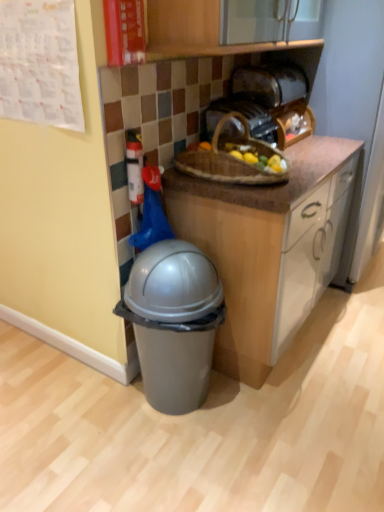
Question: Which direction should I rotate to look at satin gold toaster at upper center, the second toaster ordered from the bottom?

Choices:
 (A) left
 (B) right

Answer: (B)

Question: Is wooden basket at upper center, arranged as the 1th toaster when ordered from the bottom, not within white plastic fire extinguisher at upper left?

Choices:
 (A) no
 (B) yes

Answer: (B)

Question: Does wooden basket at upper center, arranged as the 1th toaster when ordered from the bottom, appear on the right side of white plastic fire extinguisher at upper left?

Choices:
 (A) no
 (B) yes

Answer: (B)

Question: Can you confirm if wooden basket at upper center, arranged as the 1th toaster when ordered from the bottom, is thinner than white plastic fire extinguisher at upper left?

Choices:
 (A) no
 (B) yes

Answer: (A)

Question: Is wooden basket at upper center, arranged as the 1th toaster when ordered from the bottom, oriented away from white plastic fire extinguisher at upper left?

Choices:
 (A) no
 (B) yes

Answer: (A)

Question: Can you confirm if wooden basket at upper center, which appears as the second toaster when viewed from the top, is positioned to the left of white plastic fire extinguisher at upper left?

Choices:
 (A) yes
 (B) no

Answer: (B)

Question: From the image's perspective, would you say wooden basket at upper center, which appears as the second toaster when viewed from the top, is shown under white plastic fire extinguisher at upper left?

Choices:
 (A) yes
 (B) no

Answer: (B)

Question: From the image's perspective, does satin gold toaster at upper center, the second toaster ordered from the bottom, appear lower than brown woven picnic basket at center?

Choices:
 (A) no
 (B) yes

Answer: (A)

Question: Can you confirm if satin gold toaster at upper center, placed as the first toaster when sorted from top to bottom, is taller than brown woven picnic basket at center?

Choices:
 (A) yes
 (B) no

Answer: (B)

Question: Does satin gold toaster at upper center, placed as the first toaster when sorted from top to bottom, have a greater width compared to brown woven picnic basket at center?

Choices:
 (A) yes
 (B) no

Answer: (B)

Question: Considering the relative positions of satin gold toaster at upper center, placed as the first toaster when sorted from top to bottom, and brown woven picnic basket at center in the image provided, is satin gold toaster at upper center, placed as the first toaster when sorted from top to bottom, to the left of brown woven picnic basket at center from the viewer's perspective?

Choices:
 (A) no
 (B) yes

Answer: (A)

Question: Could you tell me if satin gold toaster at upper center, placed as the first toaster when sorted from top to bottom, is facing brown woven picnic basket at center?

Choices:
 (A) no
 (B) yes

Answer: (A)

Question: Can you confirm if satin gold toaster at upper center, placed as the first toaster when sorted from top to bottom, is positioned to the right of brown woven picnic basket at center?

Choices:
 (A) no
 (B) yes

Answer: (B)

Question: Is brown woven picnic basket at center wider than wooden basket at upper center, which appears as the second toaster when viewed from the top?

Choices:
 (A) yes
 (B) no

Answer: (A)